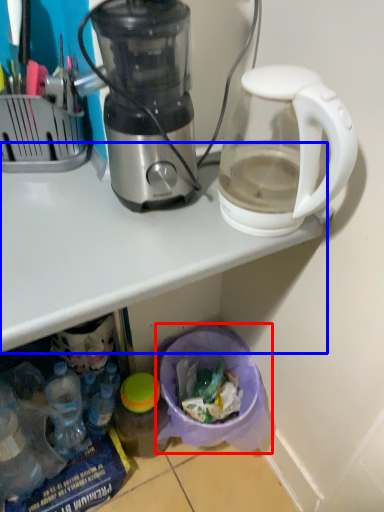
Question: Among these objects, which one is nearest to the camera, garbage (highlighted by a red box) or table (highlighted by a blue box)?

Choices:
 (A) garbage
 (B) table

Answer: (B)